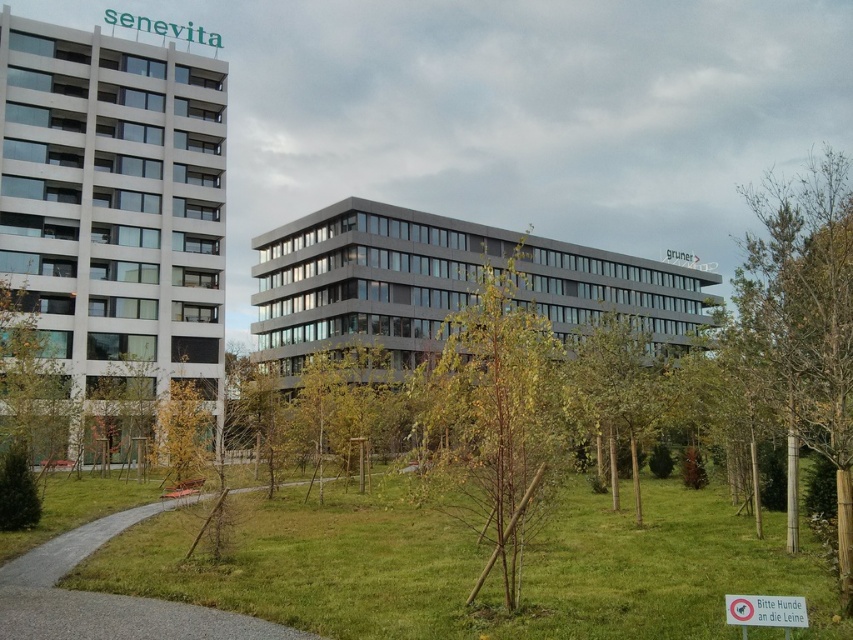
Based on the photo, you are a gardener looking at the image. You need to water the green grassy at lower left and the brown wood tree at center. Which one is located below the other?

The green grassy at lower left is positioned under brown wood tree at center, so the grass is below the tree.

You are standing at the point with coordinates 0.5, 0.5 in the image. You want to walk to the brown wood tree at center. In which direction should you move relative to your current position?

The brown wood tree at center is located at point (492, 419), which is northeast of your current position at (426, 320). Move northeast to reach it.

You are a gardener planning to water the green grassy at lower left and the green leafy tree at center. Which one should you water first if you want to avoid wetting the grass with falling water from the tree?

You should water the green grassy at lower left first before watering the green leafy tree at center because the green grassy at lower left is positioned under the green leafy tree at center. This way, when you water the tree later, the water won